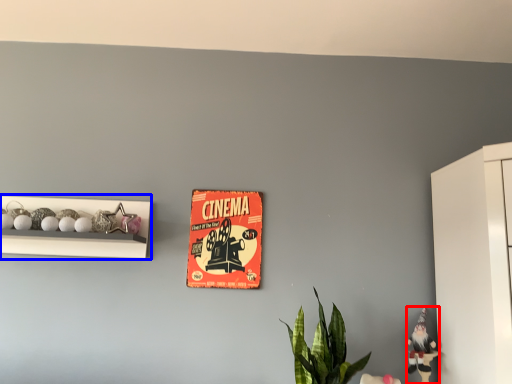
Question: Among these objects, which one is nearest to the camera, toy (highlighted by a red box) or shelf (highlighted by a blue box)?

Choices:
 (A) toy
 (B) shelf

Answer: (A)